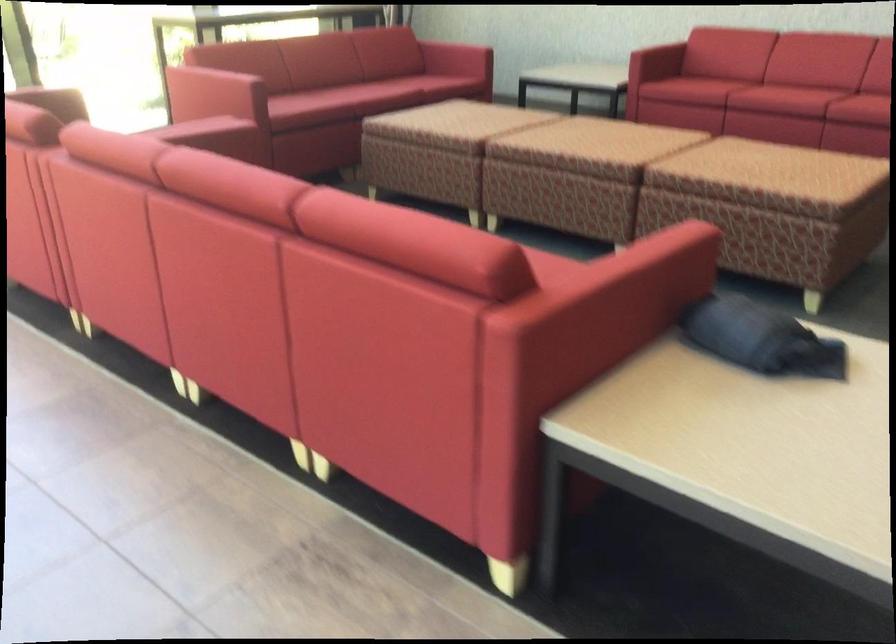
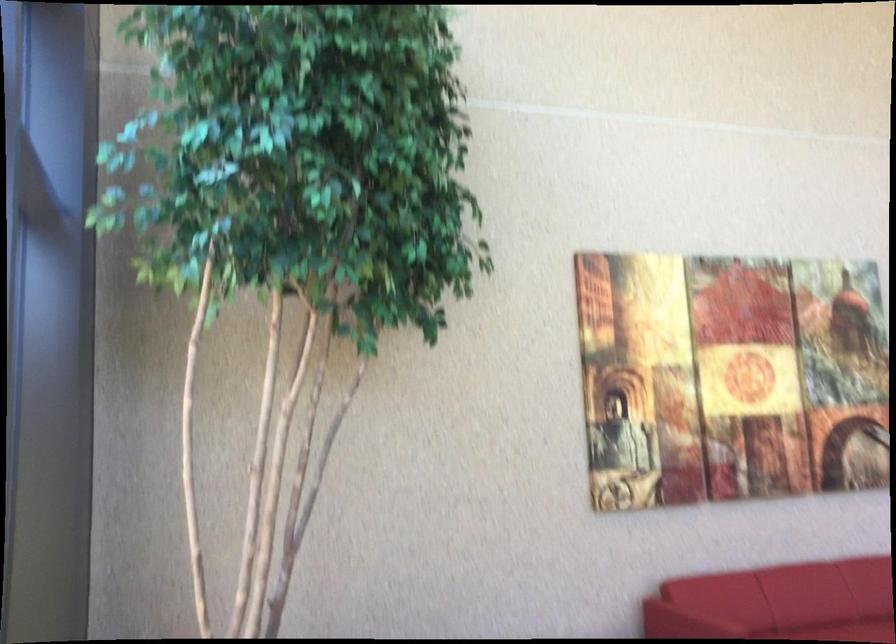
The first image is from the beginning of the video and the second image is from the end. How did the camera likely rotate when shooting the video?

The rotation direction of the camera is right-down.